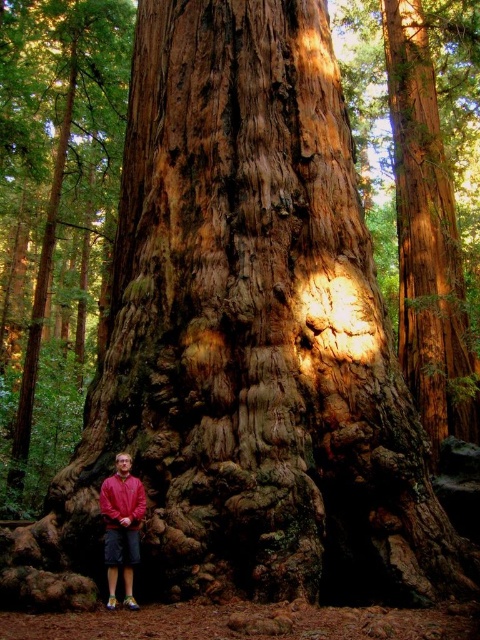
Question: Can you confirm if rough bark tree at lower left is positioned to the right of red matte sweatshirt at lower left?

Choices:
 (A) yes
 (B) no

Answer: (B)

Question: Is rough bark tree at lower left further to the viewer compared to red matte jacket at lower left?

Choices:
 (A) yes
 (B) no

Answer: (A)

Question: Does red matte jacket at lower left have a larger size compared to red matte sweatshirt at lower left?

Choices:
 (A) yes
 (B) no

Answer: (A)

Question: Which point is closer to the camera taking this photo?

Choices:
 (A) (108, 516)
 (B) (133, 6)

Answer: (A)

Question: Which point is closer to the camera?

Choices:
 (A) red matte jacket at lower left
 (B) rough bark tree at lower left
 (C) red matte sweatshirt at lower left

Answer: (A)

Question: Which of the following is the closest to the observer?

Choices:
 (A) rough bark tree at lower left
 (B) red matte sweatshirt at lower left

Answer: (B)